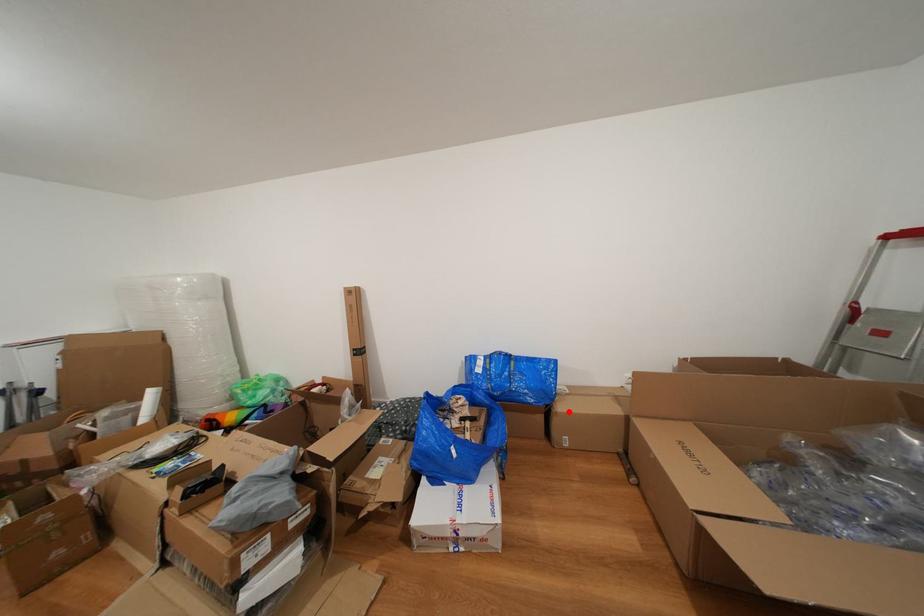
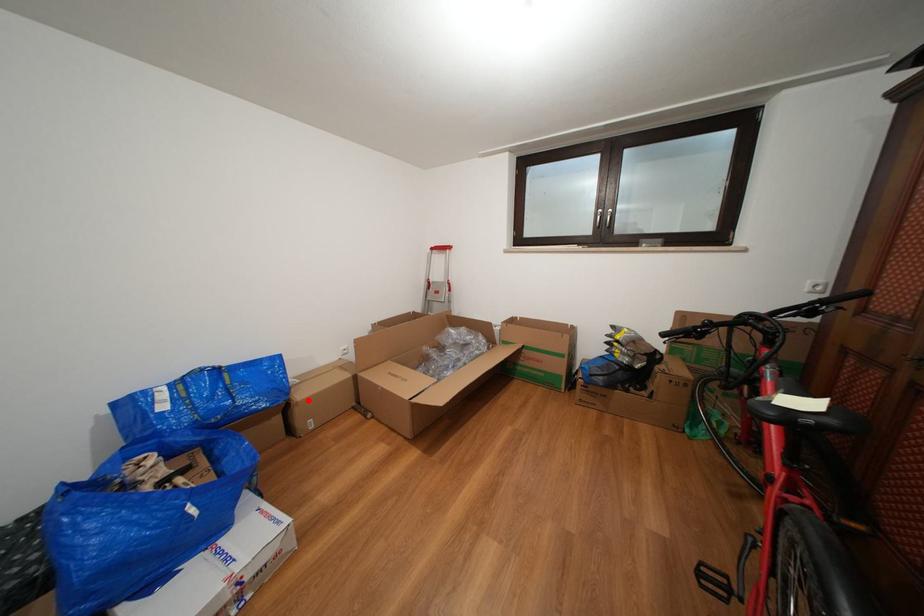
I am providing you with two images of the same scene from different viewpoints. A red point is marked on the first image and another point is marked on the second image. Are the points marked in image1 and image2 representing the same 3D position?

Yes